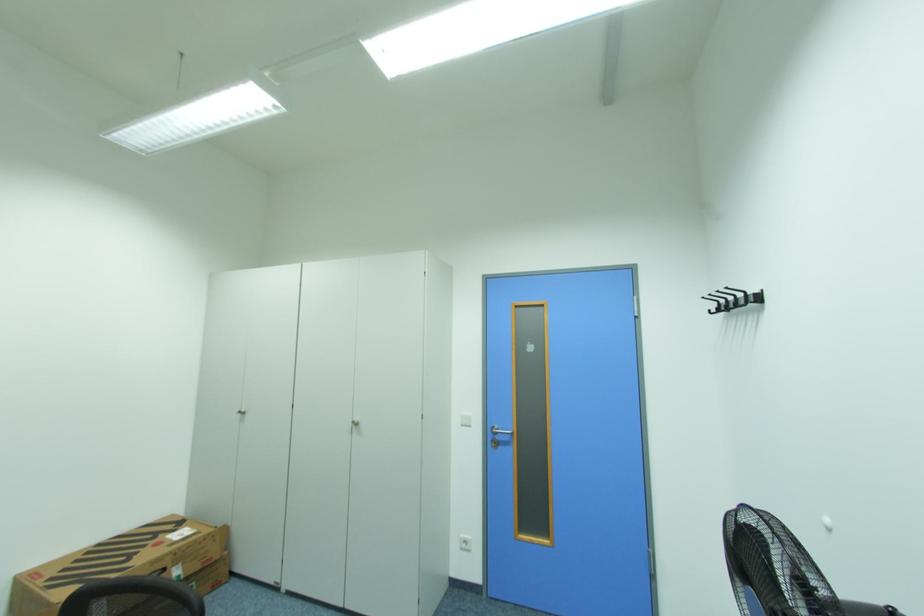
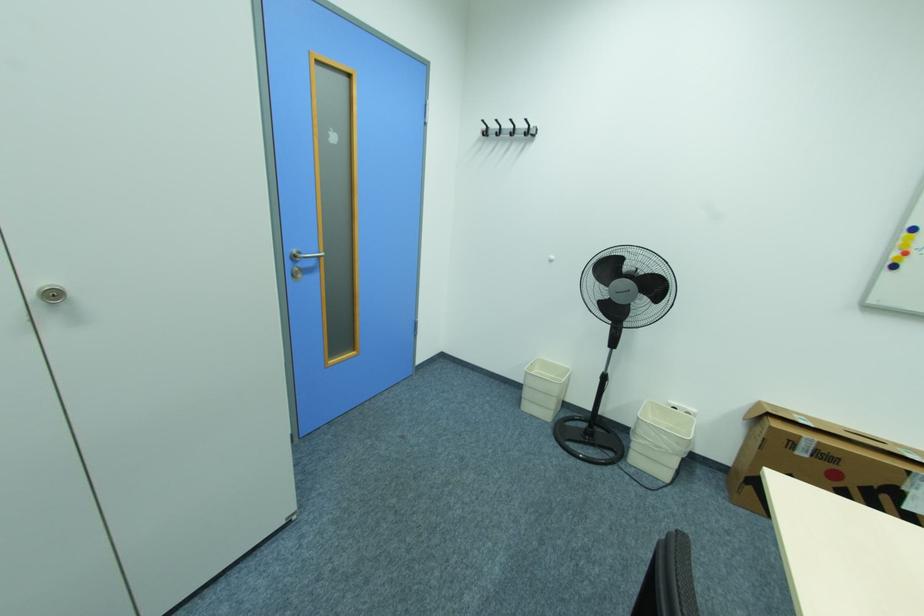
Where in the second image is the point corresponding to pixel 361 424 from the first image?

(64, 294)